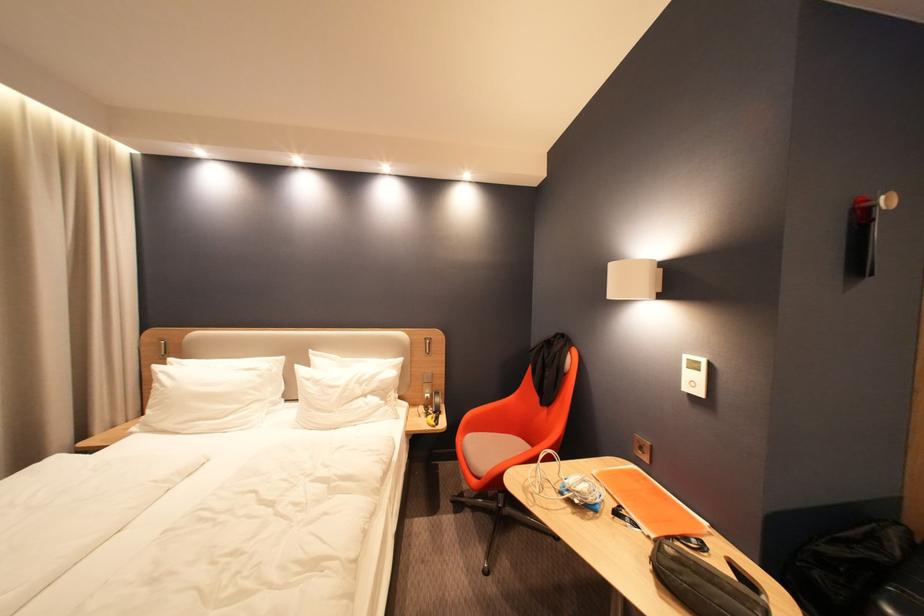
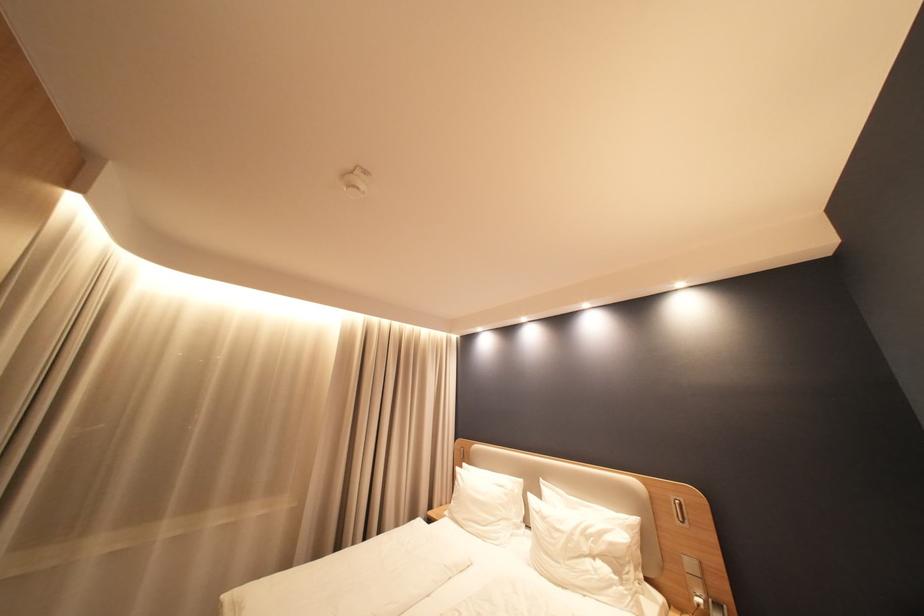
Where in the second image is the point corresponding to point 432,387 from the first image?

(696, 578)